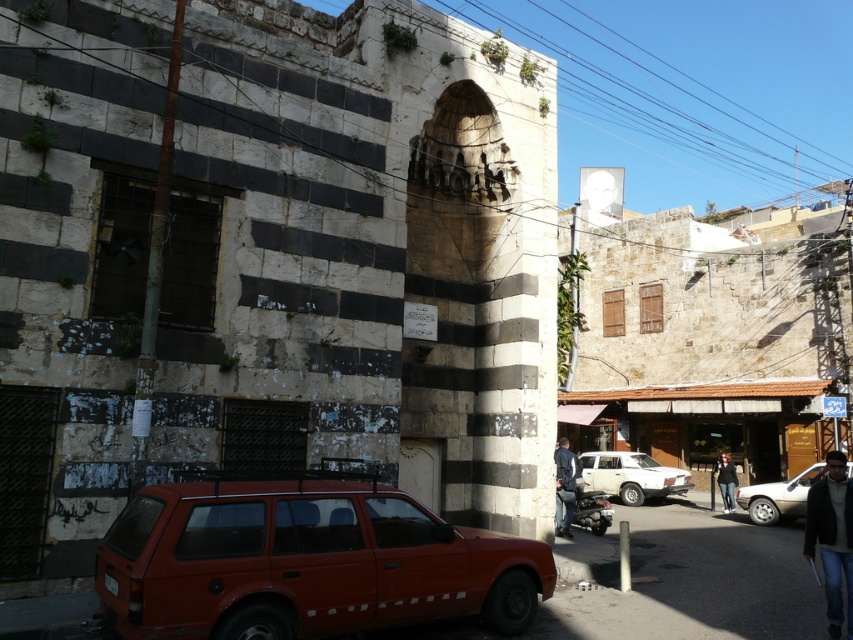
In the scene shown: You are standing on the street in front of the historic building and notice the smooth asphalt alley at lower right and the dark blue jeans at center. Which object is positioned lower in the image?

The smooth asphalt alley at lower right is located below the dark blue jeans at center, so it is positioned lower in the image.

You are walking along the street and see the smooth asphalt alley at lower right and the jeans at lower right. Which object is closer to you?

The smooth asphalt alley at lower right is closer to you than the jeans at lower right because it is further to the viewer.

You are standing at the center of the image and want to walk to the smooth asphalt alley at lower right. In which direction should you move?

You should move towards the lower right direction to reach the smooth asphalt alley at lower right.